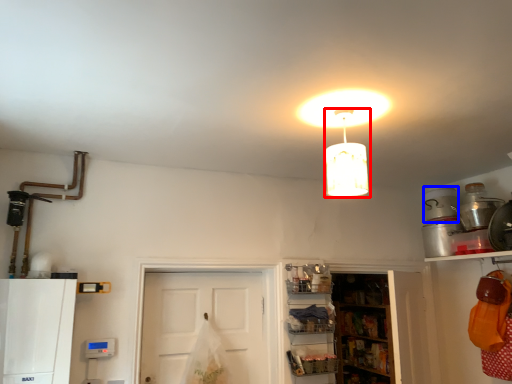
Question: Which object appears farthest to the camera in this image, lamp (highlighted by a red box) or appliance (highlighted by a blue box)?

Choices:
 (A) lamp
 (B) appliance

Answer: (B)